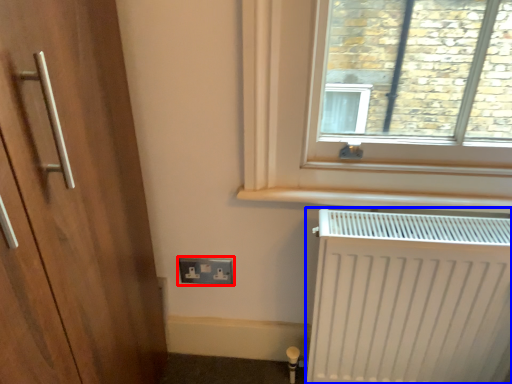
Question: Which object appears closest to the camera in this image, electric outlet (highlighted by a red box) or radiator (highlighted by a blue box)?

Choices:
 (A) electric outlet
 (B) radiator

Answer: (B)